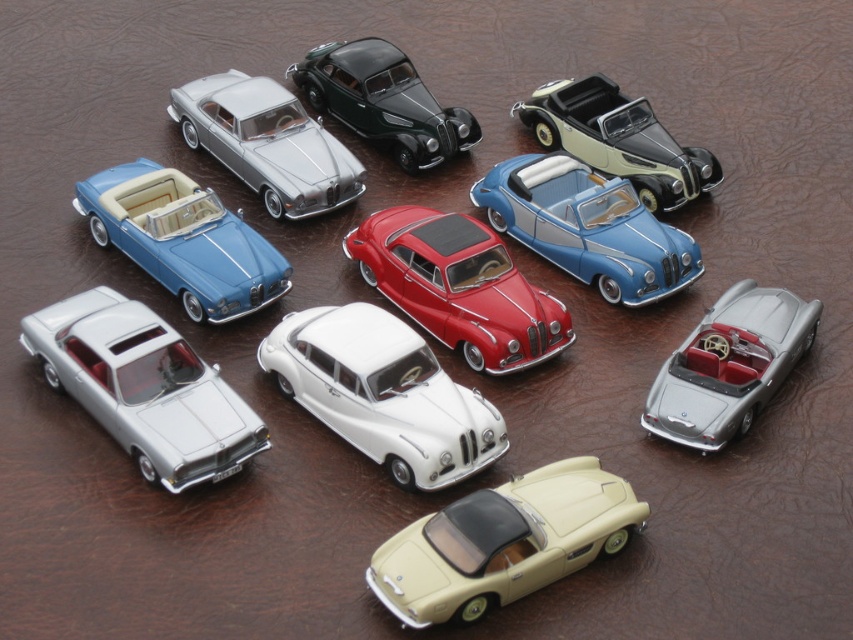
You are a collector who wants to place a new model car between the shiny red car at center and the shiny black car at upper center. The new car is 1.5 meters long. Will there be enough space between them to fit the new car?

The distance between the shiny red car at center and the shiny black car at upper center is 3.20 meters. Since the new car is 1.5 meters long, there is sufficient space to place it between them as 3.20 meters is greater than 1.5 meters.

You are organizing a display of miniature cars on a shelf and need to ensure they fit. You have two cars to place next to each other horizontally. Given that the shiny red car at center and the shiny black car at upper center are the two you want to place, which one should you place first to maximize space efficiency?

The shiny red car at center occupies less space than the shiny black car at upper center, so you should place the shiny black car at upper center first to leave more room for the smaller shiny red car at center.

You are organizing a car exhibition and need to place a new model between the white glossy sedan at center and the matte blue convertible at upper left. Based on their positions, where should the new model be placed to maintain the existing arrangement?

The white glossy sedan at center is below the matte blue convertible at upper left, so to maintain the existing arrangement, the new model should be placed between them in the vertical space between the white glossy sedan at center and the matte blue convertible at upper left.